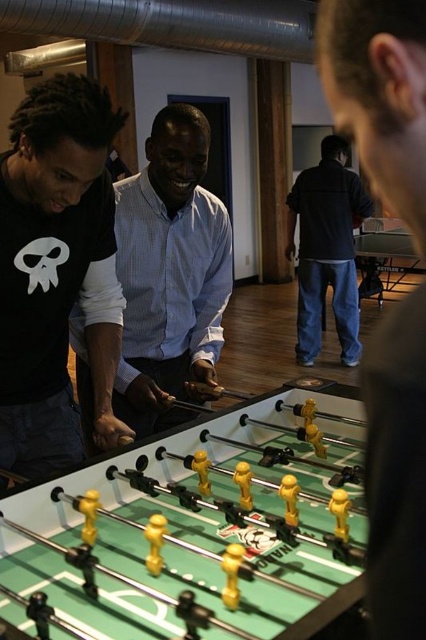
How distant is white striped shirt at center from dark blue jeans at center?

white striped shirt at center and dark blue jeans at center are 2.84 meters apart.

Is white striped shirt at center thinner than dark blue jeans at center?

Indeed, white striped shirt at center has a lesser width compared to dark blue jeans at center.

Is point (186, 352) farther from viewer compared to point (317, 189)?

No, (186, 352) is in front of (317, 189).

This screenshot has height=640, width=426. I want to click on white striped shirt at center, so click(x=169, y=273).

Consider the image. Who is higher up, black matte shirt at left or matte black shirt at center?

matte black shirt at center is above.

Measure the distance between black matte shirt at left and camera.

They are 1.00 meters apart.

Is point (46, 266) positioned in front of point (339, 51)?

No, (46, 266) is behind (339, 51).

At what (x,y) coordinates should I click in order to perform the action: click on black matte shirt at left. Please return your answer as a coordinate pair (x, y). The height and width of the screenshot is (640, 426). Looking at the image, I should click on (57, 272).

Does green plastic foosball table at center have a greater height compared to white striped shirt at center?

Incorrect, green plastic foosball table at center's height is not larger of white striped shirt at center's.

Locate an element on the screen. This screenshot has width=426, height=640. green plastic foosball table at center is located at coordinates (192, 531).